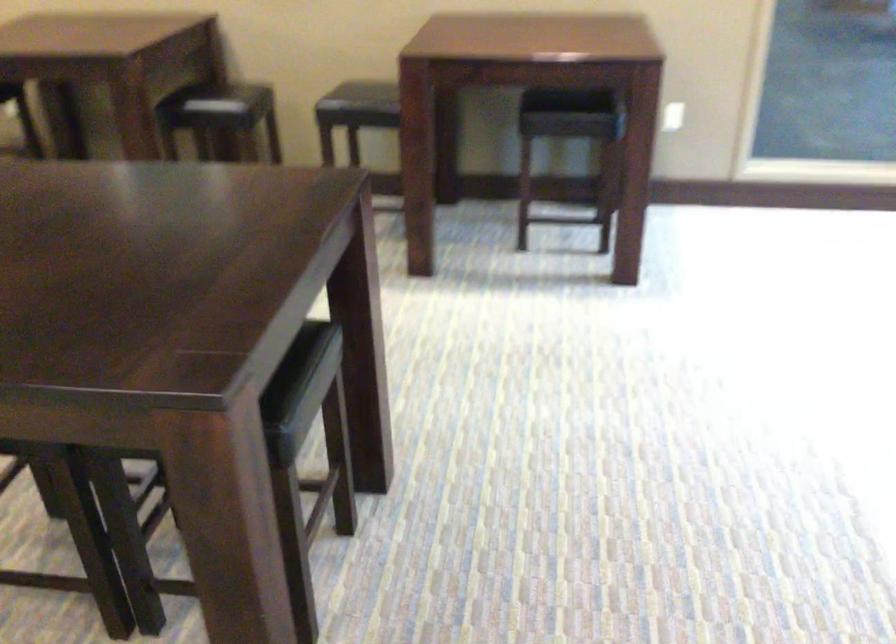
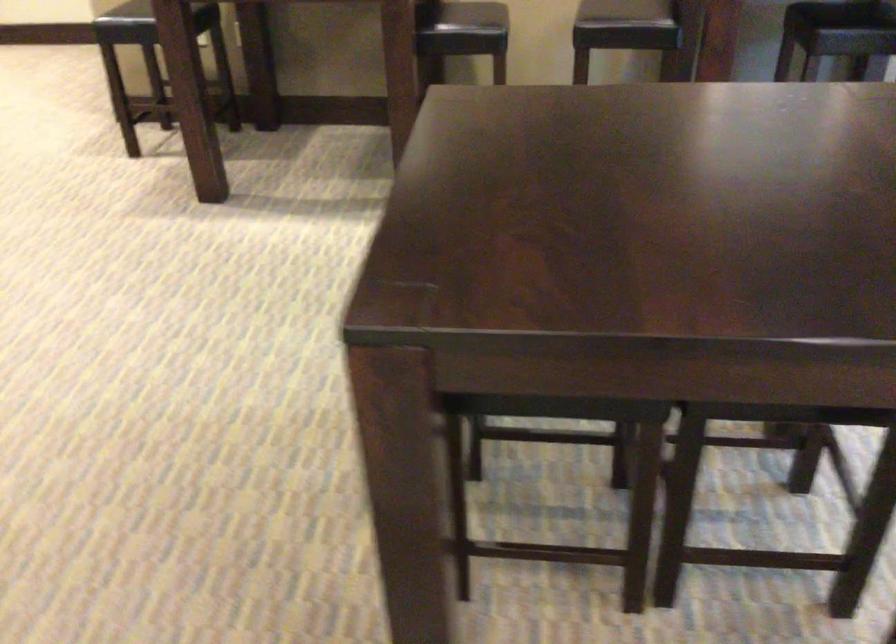
Question: The images are taken continuously from a first-person perspective. In which direction are you moving?

Choices:
 (A) Left
 (B) Right
 (C) Forward
 (D) Backward

Answer: (A)